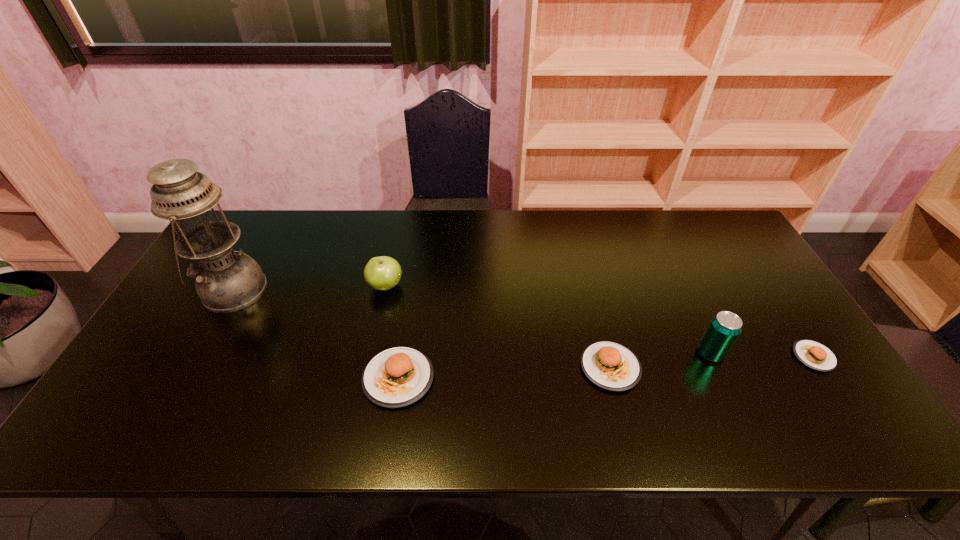
Locate an element on the screen. This screenshot has height=540, width=960. free spot between the leftmost food and the apple is located at coordinates (392, 332).

Locate an element on the screen. The image size is (960, 540). vacant point located between the apple and the leftmost food is located at coordinates (392, 332).

Point out which object is positioned as the fifth nearest to the third object from right to left. Please provide its 2D coordinates. Your answer should be formatted as a tuple, i.e. [(x, y)], where the tuple contains the x and y coordinates of a point satisfying the conditions above.

[(226, 281)]

Point out which object is positioned as the second nearest to the apple. Please provide its 2D coordinates. Your answer should be formatted as a tuple, i.e. [(x, y)], where the tuple contains the x and y coordinates of a point satisfying the conditions above.

[(226, 281)]

Identify which food is the closest to the leftmost object. Please provide its 2D coordinates. Your answer should be formatted as a tuple, i.e. [(x, y)], where the tuple contains the x and y coordinates of a point satisfying the conditions above.

[(396, 377)]

Choose which food is the second nearest neighbor to the rightmost food. Please provide its 2D coordinates. Your answer should be formatted as a tuple, i.e. [(x, y)], where the tuple contains the x and y coordinates of a point satisfying the conditions above.

[(396, 377)]

Where is `free region that satisfies the following two spatial constraints: 1. on the front side of the apple; 2. on the right side of the beer can`? free region that satisfies the following two spatial constraints: 1. on the front side of the apple; 2. on the right side of the beer can is located at coordinates (372, 353).

Find the location of `vacant space that satisfies the following two spatial constraints: 1. on the back side of the apple; 2. on the left side of the tallest object`. vacant space that satisfies the following two spatial constraints: 1. on the back side of the apple; 2. on the left side of the tallest object is located at coordinates (235, 286).

This screenshot has width=960, height=540. Identify the location of free space that satisfies the following two spatial constraints: 1. on the front side of the oil lamp; 2. on the right side of the rightmost food. (196, 356).